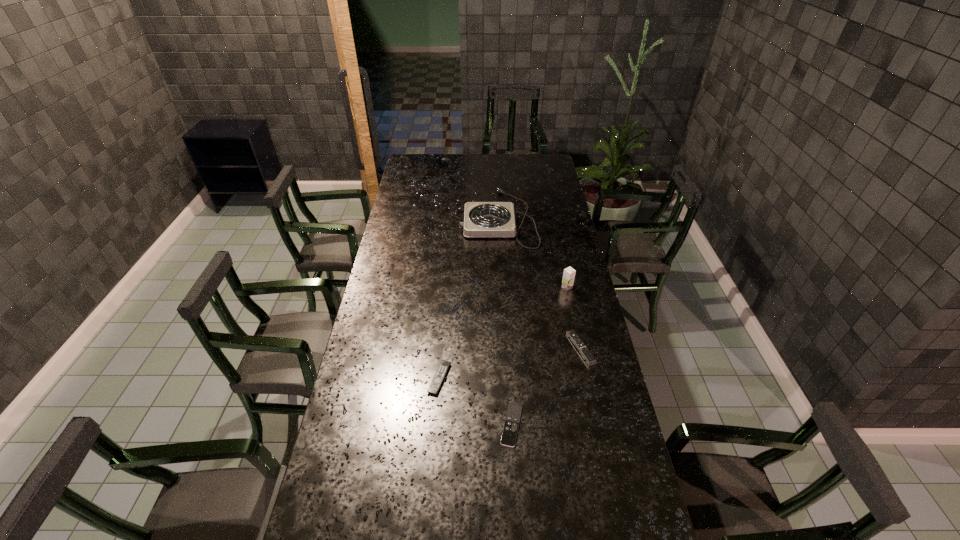
Find the location of a particular element. The image size is (960, 540). vacant area in the image that satisfies the following two spatial constraints: 1. with a retractable cable on the side of the hotplate; 2. on the front side of the leftmost remote control is located at coordinates (507, 379).

Locate an element on the screen. blank space that satisfies the following two spatial constraints: 1. on the front side of the third tallest object; 2. on the right side of the chocolate milk is located at coordinates (580, 348).

I want to click on vacant space that satisfies the following two spatial constraints: 1. on the front side of the tallest object; 2. on the right side of the rightmost remote control, so click(x=580, y=348).

You are a GUI agent. You are given a task and a screenshot of the screen. Output one action in this format:
    pyautogui.click(x=<x>, y=<y>)
    Task: Click on the vacant space that satisfies the following two spatial constraints: 1. on the front side of the third tallest object; 2. on the left side of the fourth nearest object
    
    Given the screenshot: What is the action you would take?
    pyautogui.click(x=580, y=348)

Where is `vacant space that satisfies the following two spatial constraints: 1. on the back side of the second remote control from left to right; 2. with a retractable cable on the side of the farthest object`? vacant space that satisfies the following two spatial constraints: 1. on the back side of the second remote control from left to right; 2. with a retractable cable on the side of the farthest object is located at coordinates pyautogui.click(x=499, y=218).

Identify the location of vacant space that satisfies the following two spatial constraints: 1. with a retractable cable on the side of the second tallest object; 2. on the front side of the fourth tallest object. The width and height of the screenshot is (960, 540). (507, 379).

The height and width of the screenshot is (540, 960). I want to click on vacant region that satisfies the following two spatial constraints: 1. on the back side of the nearest remote control; 2. on the right side of the chocolate milk, so click(504, 287).

Image resolution: width=960 pixels, height=540 pixels. In order to click on free location that satisfies the following two spatial constraints: 1. with a retractable cable on the side of the tallest object; 2. on the left side of the second tallest object in this screenshot , I will do `click(502, 287)`.